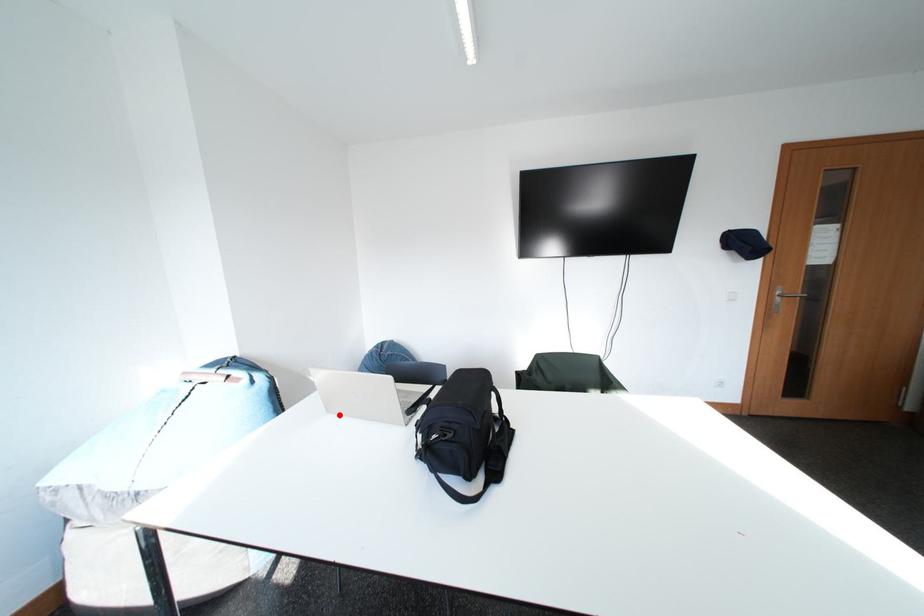
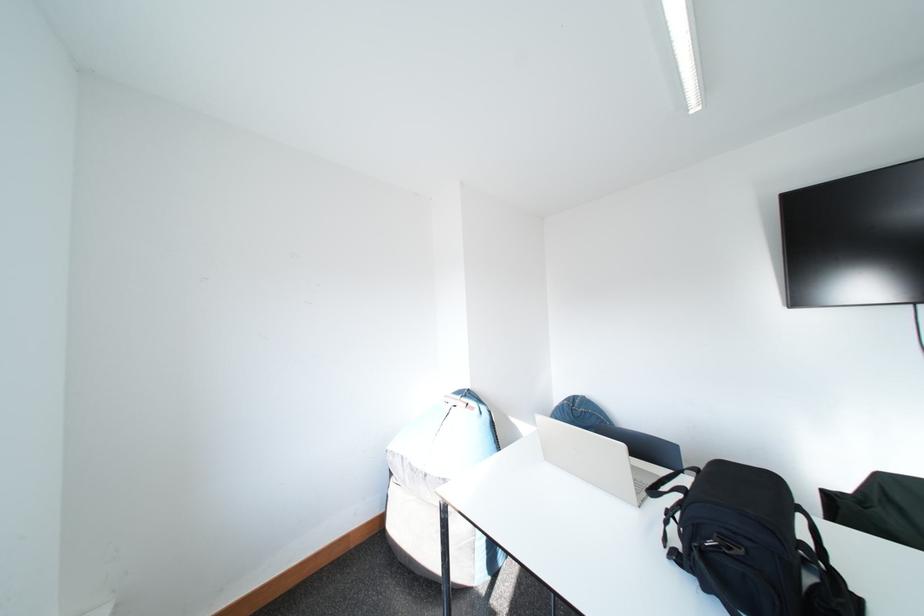
Question: I am providing you with two images of the same scene from different viewpoints. A red point is shown in image1. For the corresponding object point in image2, is it positioned nearer or farther from the camera?

Choices:
 (A) Nearer
 (B) Farther

Answer: (B)